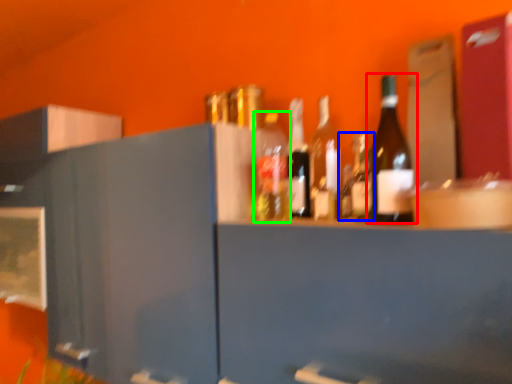
Question: Based on their relative distances, which object is farther from bottle (highlighted by a red box)? Choose from bottle (highlighted by a blue box) and bottle (highlighted by a green box).

Choices:
 (A) bottle
 (B) bottle

Answer: (B)